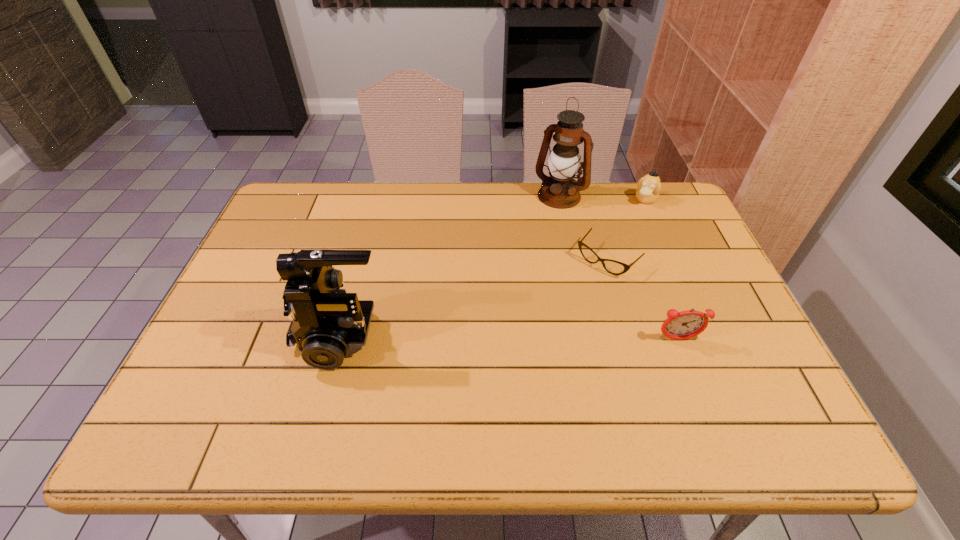
I want to click on vacant region at the far right corner of the desktop, so click(x=650, y=213).

Find the location of a particular element. Image resolution: width=960 pixels, height=540 pixels. vacant area between the second tallest object and the alarm clock is located at coordinates (510, 338).

Locate an element on the screen. The height and width of the screenshot is (540, 960). vacant area between the duckling and the alarm clock is located at coordinates (661, 269).

Find the location of a particular element. The width and height of the screenshot is (960, 540). blank region between the shortest object and the alarm clock is located at coordinates (642, 300).

Locate an element on the screen. free space between the tallest object and the duckling is located at coordinates (603, 198).

Image resolution: width=960 pixels, height=540 pixels. Identify the location of vacant space in between the tallest object and the third farthest object. (583, 228).

The height and width of the screenshot is (540, 960). In order to click on free space between the third nearest object and the tallest object in this screenshot , I will do `click(583, 228)`.

Identify the location of free spot between the alarm clock and the spectacles. The width and height of the screenshot is (960, 540). (642, 300).

Where is `unoccupied area between the spectacles and the fourth shortest object`? This screenshot has height=540, width=960. unoccupied area between the spectacles and the fourth shortest object is located at coordinates (474, 298).

Locate an element on the screen. free space between the camcorder and the lantern is located at coordinates (451, 266).